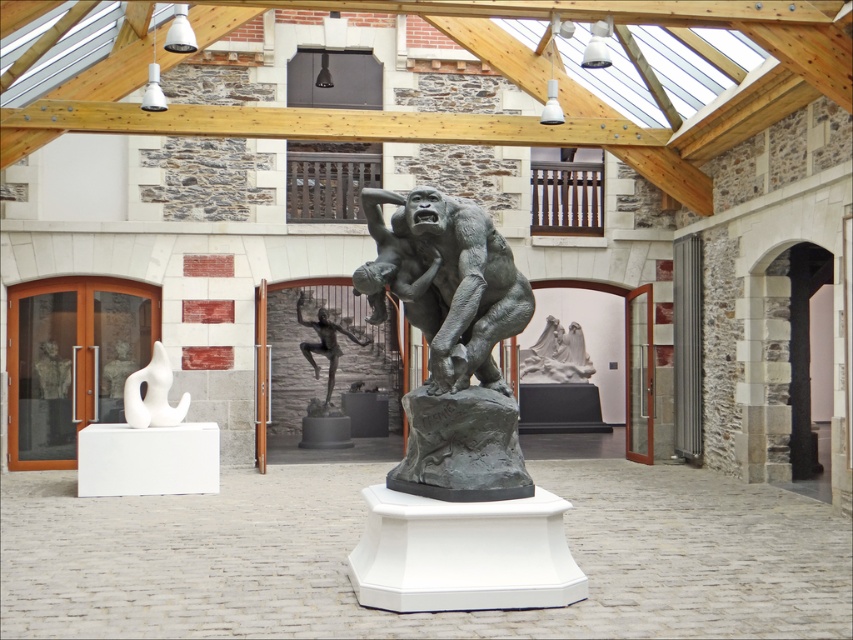
Does white glossy abstract sculpture at left appear on the left side of bronze nude figure at center?

Correct, you'll find white glossy abstract sculpture at left to the left of bronze nude figure at center.

Who is lower down, white glossy abstract sculpture at left or bronze nude figure at center?

Positioned lower is white glossy abstract sculpture at left.

At what (x,y) coordinates should I click in order to perform the action: click on white glossy abstract sculpture at left. Please return your answer as a coordinate pair (x, y). Looking at the image, I should click on (152, 394).

Does bronze statue at center lie in front of bronze nude figure at center?

Yes, bronze statue at center is in front of bronze nude figure at center.

Which is more to the right, bronze statue at center or bronze nude figure at center?

From the viewer's perspective, bronze statue at center appears more on the right side.

Where is `bronze statue at center`? Image resolution: width=853 pixels, height=640 pixels. bronze statue at center is located at coordinates (451, 340).

The height and width of the screenshot is (640, 853). Identify the location of bronze statue at center. (451, 340).

Which is more to the right, bronze statue at center or white glossy abstract sculpture at left?

Positioned to the right is bronze statue at center.

Does bronze statue at center have a lesser width compared to white glossy abstract sculpture at left?

In fact, bronze statue at center might be wider than white glossy abstract sculpture at left.

Find the location of a particular element. The image size is (853, 640). bronze statue at center is located at coordinates tap(451, 340).